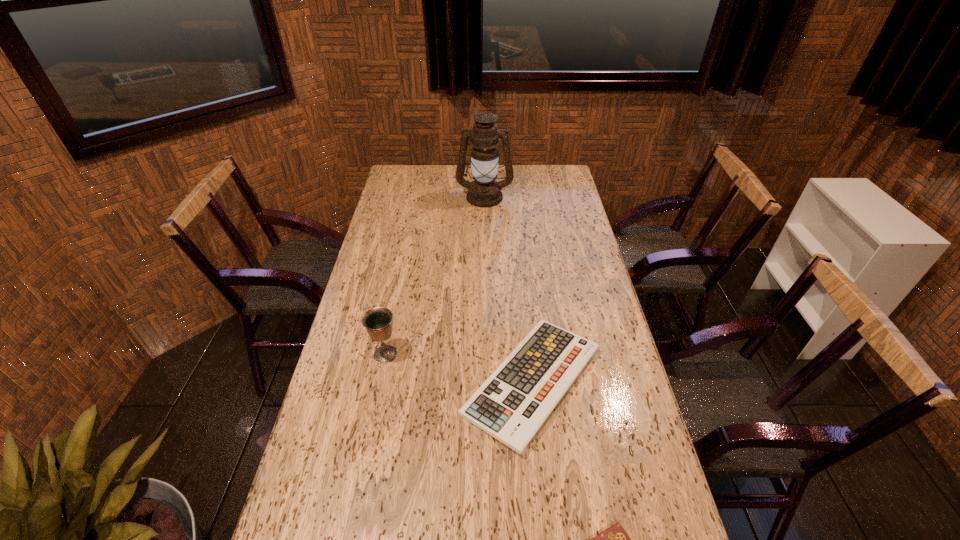
You are a GUI agent. You are given a task and a screenshot of the screen. Output one action in this format:
    pyautogui.click(x=<x>, y=<y>)
    Task: Click on the object that is at the right edge
    
    Given the screenshot: What is the action you would take?
    pyautogui.click(x=512, y=404)

Locate an element on the screen. The height and width of the screenshot is (540, 960). vacant area at the far edge of the desktop is located at coordinates (426, 184).

In the image, there is a desktop. At what (x,y) coordinates should I click in order to perform the action: click on free space at the left edge. Please return your answer as a coordinate pair (x, y). Looking at the image, I should click on (317, 435).

The height and width of the screenshot is (540, 960). I want to click on free space at the right edge of the desktop, so click(607, 387).

In the image, there is a desktop. Where is `blank space at the far right corner`? The width and height of the screenshot is (960, 540). blank space at the far right corner is located at coordinates (544, 166).

Identify the location of free space between the tallest object and the computer keyboard. Image resolution: width=960 pixels, height=540 pixels. (508, 289).

Where is `unoccupied area between the third shortest object and the computer keyboard`? The height and width of the screenshot is (540, 960). unoccupied area between the third shortest object and the computer keyboard is located at coordinates (459, 368).

Locate an element on the screen. This screenshot has height=540, width=960. free space between the leftmost object and the tallest object is located at coordinates (435, 275).

Identify the location of vacant area that lies between the leftmost object and the computer keyboard. This screenshot has width=960, height=540. (459, 368).

You are a GUI agent. You are given a task and a screenshot of the screen. Output one action in this format:
    pyautogui.click(x=<x>, y=<y>)
    Task: Click on the free space between the third shortest object and the computer keyboard
    The height and width of the screenshot is (540, 960).
    Given the screenshot: What is the action you would take?
    pyautogui.click(x=459, y=368)